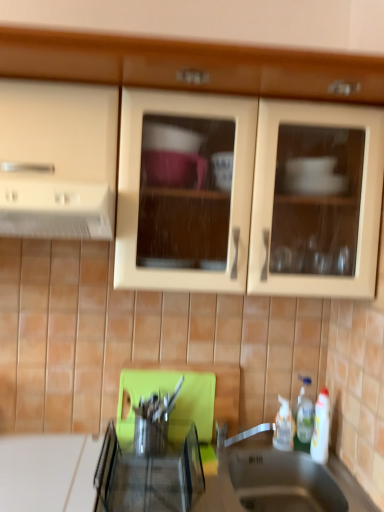
Question: Can you confirm if white glossy bottle at lower right, the 1th bottle positioned from the right, is bigger than matte wood cabinets at upper center?

Choices:
 (A) no
 (B) yes

Answer: (A)

Question: Is white glossy bottle at lower right, which is the 2th bottle from left to right, touching matte wood cabinets at upper center?

Choices:
 (A) no
 (B) yes

Answer: (A)

Question: Could matte wood cabinets at upper center be considered to be inside white glossy bottle at lower right, the 1th bottle positioned from the right?

Choices:
 (A) no
 (B) yes

Answer: (A)

Question: Is white glossy bottle at lower right, which is the 2th bottle from left to right, wider than matte wood cabinets at upper center?

Choices:
 (A) no
 (B) yes

Answer: (A)

Question: Would you consider white glossy bottle at lower right, which is the 2th bottle from left to right, to be distant from matte wood cabinets at upper center?

Choices:
 (A) no
 (B) yes

Answer: (A)

Question: Is white glossy bottle at lower right, the 1th bottle positioned from the right, facing away from matte wood cabinets at upper center?

Choices:
 (A) no
 (B) yes

Answer: (A)

Question: Does white matte exhaust hood at left have a smaller size compared to white plastic bottle at lower right, acting as the 1th bottle starting from the left?

Choices:
 (A) yes
 (B) no

Answer: (B)

Question: Is white matte exhaust hood at left looking in the opposite direction of white plastic bottle at lower right, acting as the 2th bottle starting from the right?

Choices:
 (A) yes
 (B) no

Answer: (B)

Question: Can you confirm if white matte exhaust hood at left is taller than white plastic bottle at lower right, acting as the 1th bottle starting from the left?

Choices:
 (A) no
 (B) yes

Answer: (A)

Question: From the image's perspective, is white matte exhaust hood at left below white plastic bottle at lower right, acting as the 2th bottle starting from the right?

Choices:
 (A) no
 (B) yes

Answer: (A)

Question: Is white matte exhaust hood at left not within white plastic bottle at lower right, acting as the 2th bottle starting from the right?

Choices:
 (A) yes
 (B) no

Answer: (A)

Question: From the image's perspective, does white matte exhaust hood at left appear higher than white plastic bottle at lower right, acting as the 1th bottle starting from the left?

Choices:
 (A) yes
 (B) no

Answer: (A)

Question: Does white glossy bottle at lower right, which is the 2th bottle from left to right, appear on the right side of metallic stainless steel sink at lower center?

Choices:
 (A) yes
 (B) no

Answer: (A)